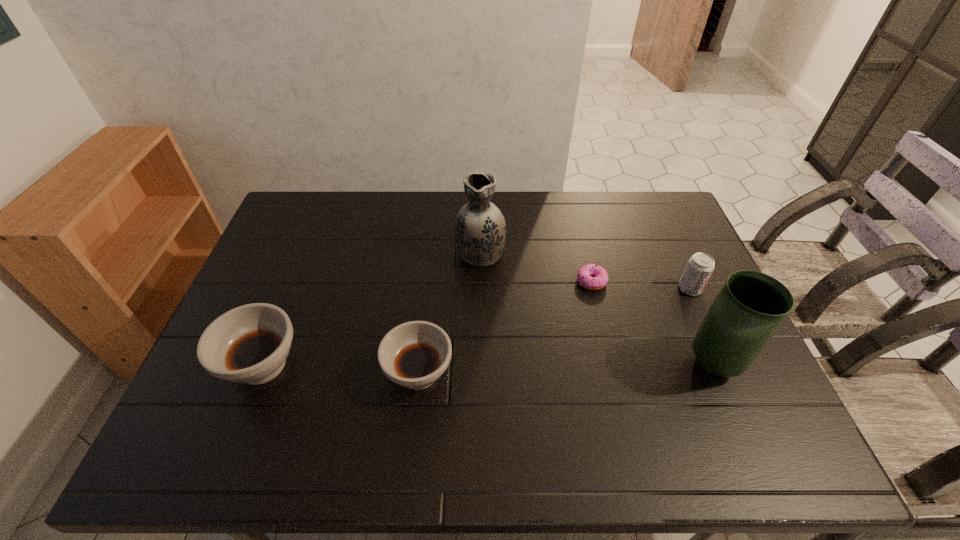
In order to click on the leftmost object in this screenshot , I will do `click(249, 344)`.

Locate an element on the screen. This screenshot has width=960, height=540. the taller soup bowl is located at coordinates (249, 344).

Find the location of a particular element. the shorter soup bowl is located at coordinates (415, 354).

In order to click on the fifth tallest object in this screenshot , I will do `click(415, 354)`.

Where is `the farther vase`? The image size is (960, 540). the farther vase is located at coordinates (480, 229).

What are the coordinates of `the right vase` in the screenshot? It's located at (751, 306).

Find the location of a particular element. Image resolution: width=960 pixels, height=540 pixels. the fourth object from left to right is located at coordinates (600, 277).

Identify the location of doughnut. This screenshot has width=960, height=540. (600, 277).

Locate an element on the screen. soda can is located at coordinates (700, 266).

Where is `free space located on the right of the leftmost object`? free space located on the right of the leftmost object is located at coordinates (366, 365).